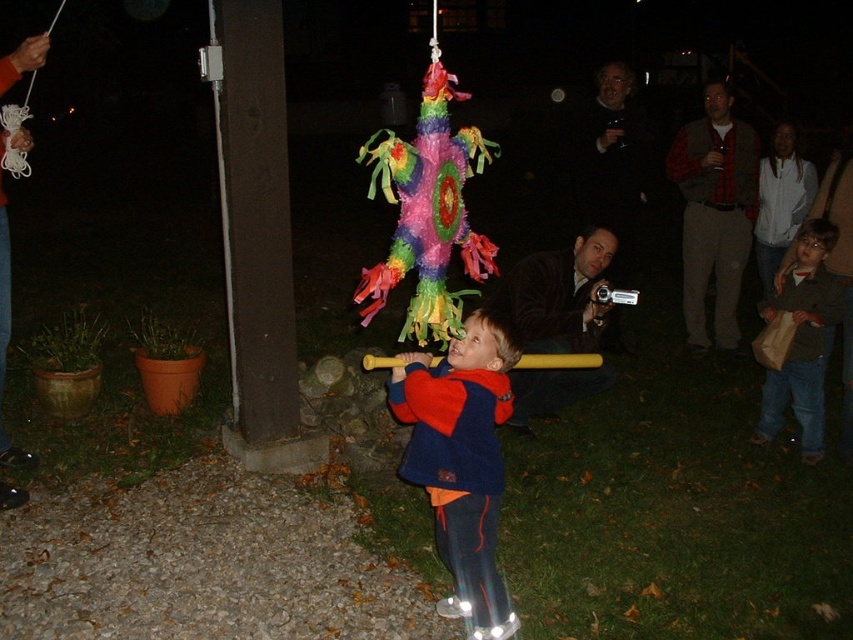
Question: Is dark brown leather jacket at center to the right of brown paper bag at lower right from the viewer's perspective?

Choices:
 (A) no
 (B) yes

Answer: (A)

Question: Among these objects, which one is farthest from the camera?

Choices:
 (A) red plaid shirt at upper right
 (B) white fleece jacket at upper right
 (C) blue fleece jacket at center

Answer: (A)

Question: Is dark brown leather jacket at center positioned before white fleece jacket at upper right?

Choices:
 (A) no
 (B) yes

Answer: (B)

Question: Can you confirm if blue fleece jacket at center is positioned below white fleece jacket at upper right?

Choices:
 (A) yes
 (B) no

Answer: (A)

Question: Which of the following is the closest to the observer?

Choices:
 (A) blue fleece jacket at center
 (B) dark brown leather jacket at center
 (C) white fleece jacket at upper right
 (D) brown paper bag at lower right

Answer: (A)

Question: Which point appears farthest from the camera in this image?

Choices:
 (A) (776, 417)
 (B) (527, 291)

Answer: (A)